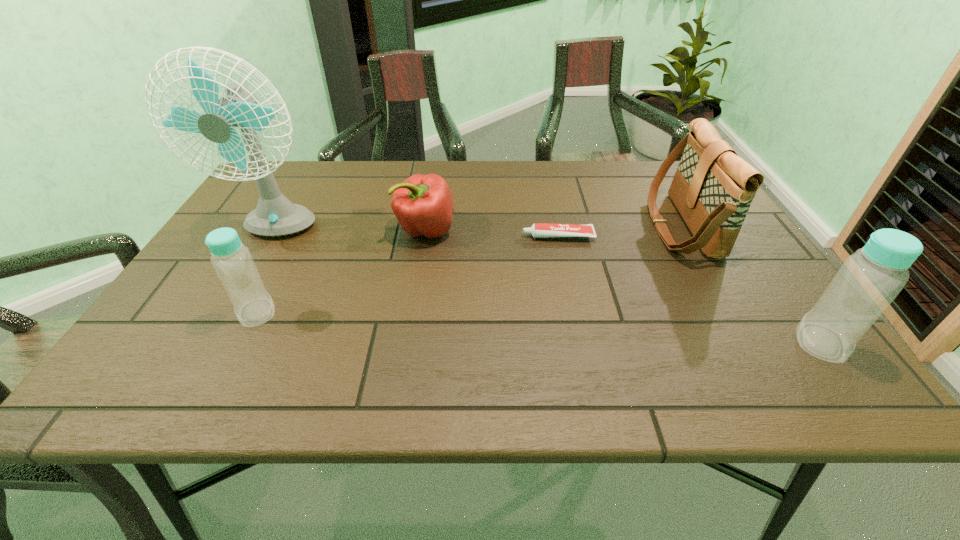
Locate an element on the screen. This screenshot has height=540, width=960. object situated at the far edge is located at coordinates (713, 188).

The width and height of the screenshot is (960, 540). What are the coordinates of `bottle positioned at the left edge` in the screenshot? It's located at (232, 261).

Locate an element on the screen. The width and height of the screenshot is (960, 540). fan situated at the left edge is located at coordinates click(275, 215).

This screenshot has height=540, width=960. I want to click on bottle located in the right edge section of the desktop, so pos(869,280).

This screenshot has width=960, height=540. Find the location of `shoulder bag located in the right edge section of the desktop`. shoulder bag located in the right edge section of the desktop is located at coordinates (713, 188).

This screenshot has width=960, height=540. I want to click on object that is at the near left corner, so click(x=232, y=261).

In order to click on object present at the far right corner in this screenshot , I will do `click(713, 188)`.

This screenshot has width=960, height=540. I want to click on object that is at the near right corner, so click(869, 280).

At what (x,y) coordinates should I click in order to perform the action: click on vacant space at the far edge of the desktop. Please return your answer as a coordinate pair (x, y). The height and width of the screenshot is (540, 960). Looking at the image, I should click on (481, 168).

Locate an element on the screen. Image resolution: width=960 pixels, height=540 pixels. vacant space at the near edge of the desktop is located at coordinates (396, 321).